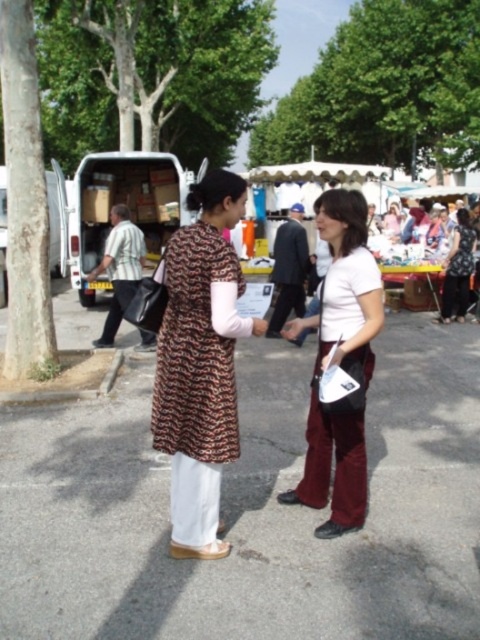
Question: Is the position of white matte shirt at center more distant than that of matte black dress at center?

Choices:
 (A) yes
 (B) no

Answer: (B)

Question: Does striped shirt at left appear on the left side of dark suit at center?

Choices:
 (A) yes
 (B) no

Answer: (A)

Question: Can you confirm if brown printed dress at center is wider than matte black dress at center?

Choices:
 (A) no
 (B) yes

Answer: (B)

Question: Which point is farther from the camera taking this photo?

Choices:
 (A) (219, 545)
 (B) (120, 228)
 (C) (303, 250)

Answer: (C)

Question: Estimate the real-world distances between objects in this image. Which object is farther from the white matte shirt at center?

Choices:
 (A) dark suit at center
 (B) striped shirt at left

Answer: (A)

Question: Which point is farther from the camera taking this photo?

Choices:
 (A) (213, 509)
 (B) (342, 216)
 (C) (285, 317)

Answer: (C)